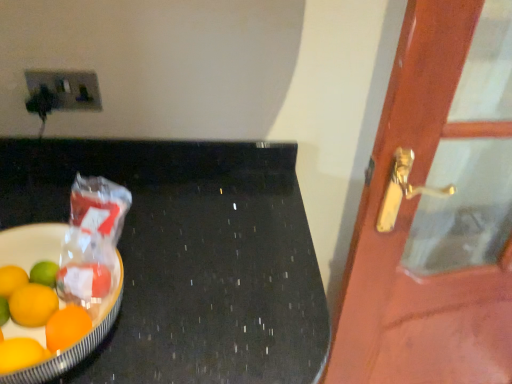
Question: Could black polished table at left be considered to be inside wooden door at right?

Choices:
 (A) yes
 (B) no

Answer: (B)

Question: From the image's perspective, is wooden door at right located above black polished table at left?

Choices:
 (A) yes
 (B) no

Answer: (A)

Question: Does wooden door at right have a smaller size compared to black polished table at left?

Choices:
 (A) yes
 (B) no

Answer: (A)

Question: Does wooden door at right have a larger size compared to black polished table at left?

Choices:
 (A) yes
 (B) no

Answer: (B)

Question: Is wooden door at right wider than black polished table at left?

Choices:
 (A) no
 (B) yes

Answer: (A)

Question: Is point (120, 292) closer or farther from the camera than point (135, 352)?

Choices:
 (A) closer
 (B) farther

Answer: (B)

Question: Is shiny plastic bowl at left spatially inside black polished table at left, or outside of it?

Choices:
 (A) inside
 (B) outside

Answer: (B)

Question: In the image, is shiny plastic bowl at left on the left side or the right side of black polished table at left?

Choices:
 (A) right
 (B) left

Answer: (B)

Question: Is shiny plastic bowl at left wider or thinner than black polished table at left?

Choices:
 (A) thin
 (B) wide

Answer: (A)

Question: In the image, is shiny plastic bowl at left positioned in front of or behind wooden door at right?

Choices:
 (A) front
 (B) behind

Answer: (A)

Question: In terms of width, does shiny plastic bowl at left look wider or thinner when compared to wooden door at right?

Choices:
 (A) thin
 (B) wide

Answer: (B)

Question: Considering the positions of point (96, 321) and point (354, 329), is point (96, 321) closer or farther from the camera than point (354, 329)?

Choices:
 (A) farther
 (B) closer

Answer: (B)

Question: Is shiny plastic bowl at left to the left or to the right of wooden door at right in the image?

Choices:
 (A) right
 (B) left

Answer: (B)

Question: From the image's perspective, relative to shiny plastic bowl at left, is matte plastic socket at upper left above or below?

Choices:
 (A) above
 (B) below

Answer: (A)

Question: From their relative heights in the image, would you say matte plastic socket at upper left is taller or shorter than shiny plastic bowl at left?

Choices:
 (A) tall
 (B) short

Answer: (B)